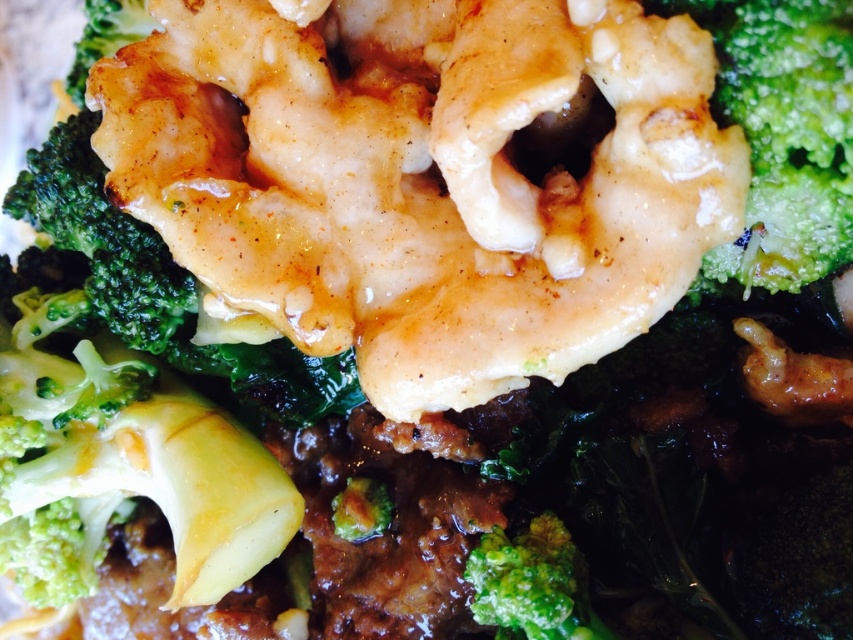
Question: Can you confirm if glistening white shrimp at center is thinner than green matte broccoli at center?

Choices:
 (A) no
 (B) yes

Answer: (A)

Question: Which point is farther from the camera taking this photo?

Choices:
 (A) (248, 317)
 (B) (541, 572)

Answer: (A)

Question: Which object is farther from the camera taking this photo?

Choices:
 (A) green matte broccoli at center
 (B) glistening white shrimp at center

Answer: (A)

Question: Considering the relative positions of glistening white shrimp at center and green matte broccoli at center in the image provided, where is glistening white shrimp at center located with respect to green matte broccoli at center?

Choices:
 (A) below
 (B) above

Answer: (B)

Question: Which point appears closest to the camera in this image?

Choices:
 (A) (693, 262)
 (B) (538, 548)

Answer: (A)

Question: Can you confirm if glistening white shrimp at center is positioned to the right of green matte broccoli at center?

Choices:
 (A) no
 (B) yes

Answer: (A)